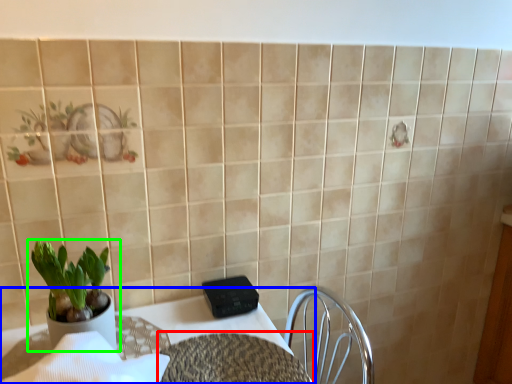
Question: Considering the real-world distances, which object is closest to round table (highlighted by a red box)? table (highlighted by a blue box) or houseplant (highlighted by a green box).

Choices:
 (A) table
 (B) houseplant

Answer: (A)